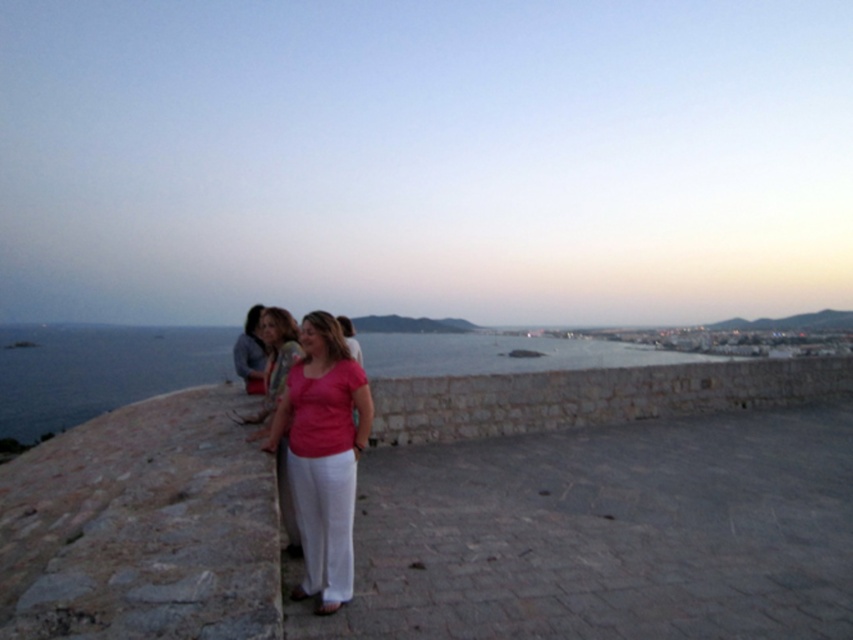
Question: Which point appears closest to the camera in this image?

Choices:
 (A) click(x=216, y=372)
 (B) click(x=264, y=355)
 (C) click(x=340, y=365)
 (D) click(x=286, y=349)

Answer: (C)

Question: Can you confirm if matte pink blouse at center is bigger than matte pink shirt at left?

Choices:
 (A) yes
 (B) no

Answer: (B)

Question: From the image, what is the correct spatial relationship of matte pink blouse at center in relation to matte pink shirt at left?

Choices:
 (A) left
 (B) right

Answer: (B)

Question: Considering the real-world distances, which object is closest to the matte pink blouse at center?

Choices:
 (A) matte pink shirt at left
 (B) blue water at center

Answer: (A)

Question: Which point is farther from the camera taking this photo?

Choices:
 (A) (350, 545)
 (B) (273, 353)

Answer: (B)

Question: Is matte pink shirt at center positioned before matte pink blouse at center?

Choices:
 (A) yes
 (B) no

Answer: (A)